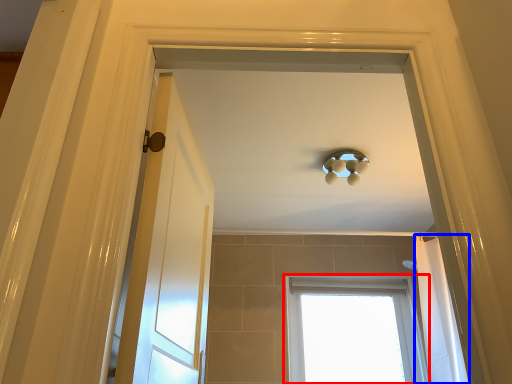
Question: Among these objects, which one is farthest to the camera, window (highlighted by a red box) or shower curtain (highlighted by a blue box)?

Choices:
 (A) window
 (B) shower curtain

Answer: (A)